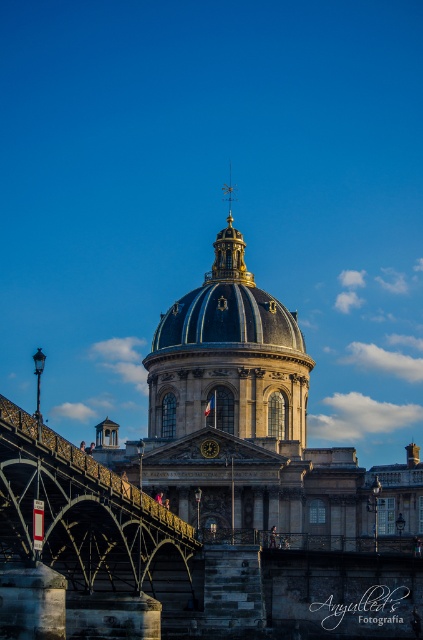
You are standing at the point with coordinates (87, 534) in the image of the historic building. What object is located at this coordinate?

The point at coordinates (87, 534) corresponds to the stone bridge at center.

You are standing in front of the historic building and want to take a photo. You notice two points marked on the dome. Which point, point [57,460] or point [98,480], is closer to your camera lens?

Point [57,460] is closer to the camera than point [98,480].

You are a tourist standing on the stone bridge at center. You want to take a photo of the matte gold dome at center. Can you see the dome clearly from your current position?

The stone bridge at center is positioned under the matte gold dome at center, so you are directly underneath it. To see the dome clearly, you would need to move to a position where you can look upward towards the dome.